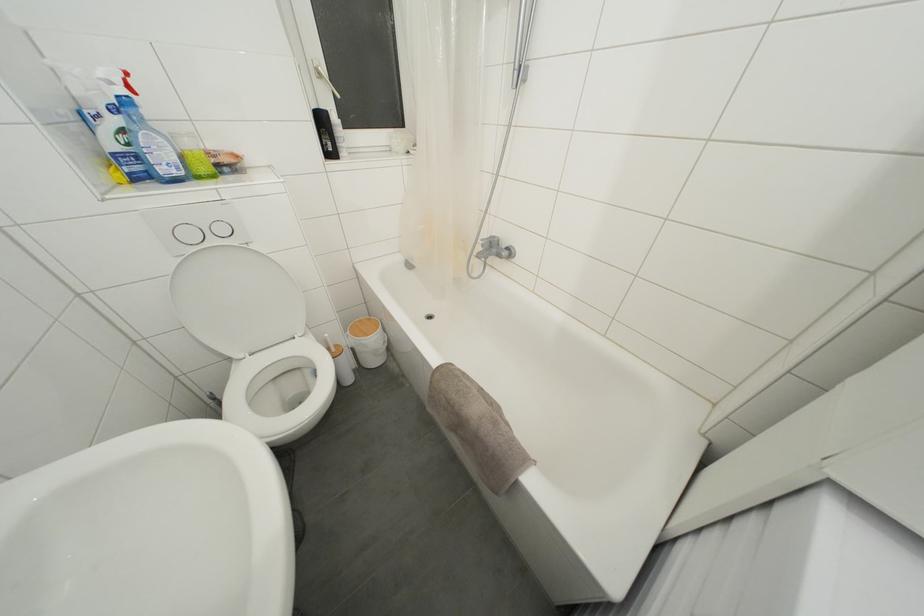
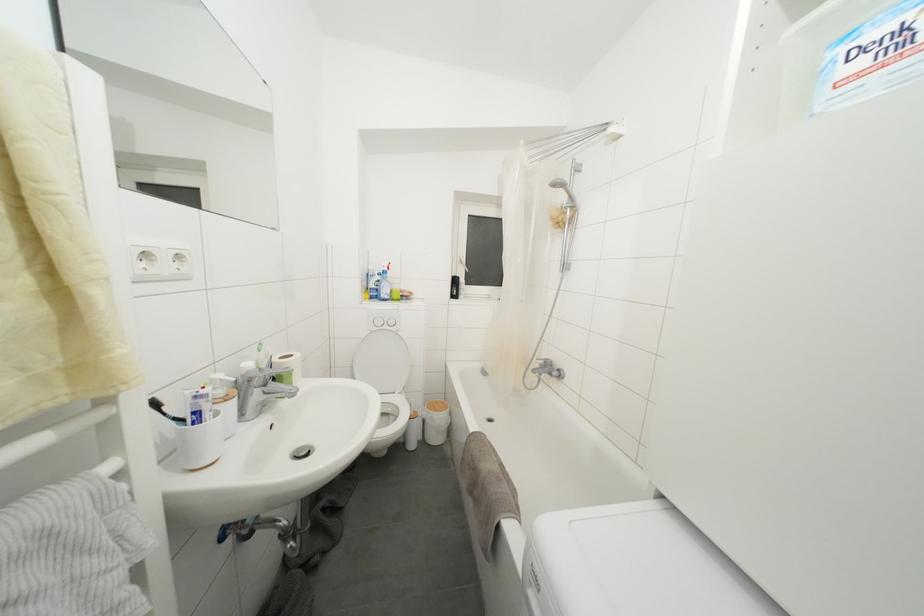
The first image is from the beginning of the video and the second image is from the end. How did the camera likely rotate when shooting the video?

The camera rotated toward left-up.